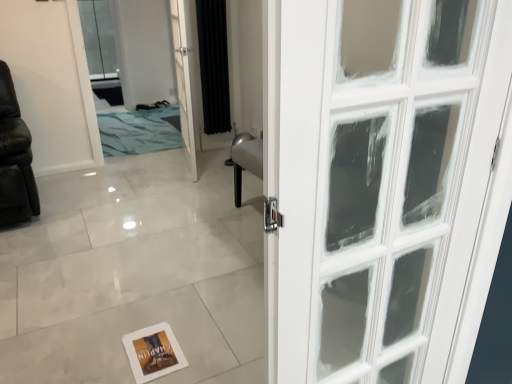
Locate an element on the screen. This screenshot has width=512, height=384. free space in front of white glass door at center is located at coordinates (181, 183).